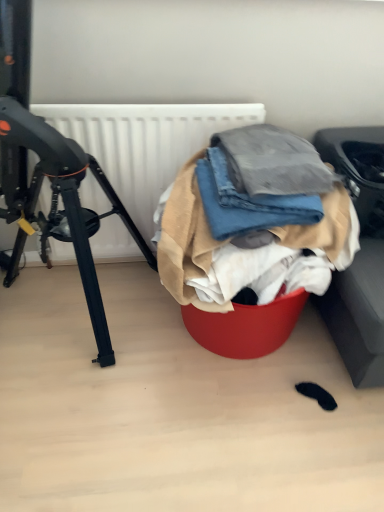
The image size is (384, 512). Describe the element at coordinates (65, 203) in the screenshot. I see `black matte tripod at left` at that location.

Describe the element at coordinates (273, 162) in the screenshot. The width and height of the screenshot is (384, 512). I see `denim fabric at center, marked as the first clothing in a top-to-bottom arrangement` at that location.

Locate an element on the screen. The width and height of the screenshot is (384, 512). white matte radiator at upper center is located at coordinates (145, 143).

The image size is (384, 512). I want to click on denim fabric at center, which ranks as the first clothing in bottom-to-top order, so click(252, 223).

This screenshot has height=512, width=384. Identify the location of black matte tripod at left. (65, 203).

Who is smaller, denim fabric at center, the 3th clothing when ordered from bottom to top, or denim fabric at center, marked as the third clothing in a top-to-bottom arrangement?

With smaller size is denim fabric at center, the 3th clothing when ordered from bottom to top.

Does denim fabric at center, the 3th clothing when ordered from bottom to top, contain denim fabric at center, which ranks as the first clothing in bottom-to-top order?

Answer: Actually, denim fabric at center, which ranks as the first clothing in bottom-to-top order, is outside denim fabric at center, the 3th clothing when ordered from bottom to top.

Looking at this image, is denim fabric at center, marked as the first clothing in a top-to-bottom arrangement, far from denim fabric at center, marked as the third clothing in a top-to-bottom arrangement?

No, denim fabric at center, marked as the first clothing in a top-to-bottom arrangement, is in close proximity to denim fabric at center, marked as the third clothing in a top-to-bottom arrangement.

From the image's perspective, count 2nd clothings upward from the denim fabric at center, which ranks as the first clothing in bottom-to-top order, and point to it. Please provide its 2D coordinates.

[(273, 162)]

Is denim fabric at center, the 3th clothing when ordered from bottom to top, taller or shorter than denim fabric at center, acting as the second clothing starting from the bottom?

Considering their sizes, denim fabric at center, the 3th clothing when ordered from bottom to top, has less height than denim fabric at center, acting as the second clothing starting from the bottom.

Is point (257, 146) less distant than point (298, 197)?

That is False.

From the image's perspective, who appears lower, denim fabric at center, marked as the first clothing in a top-to-bottom arrangement, or denim fabric at center, which is the second clothing in top-to-bottom order?

From the image's view, denim fabric at center, which is the second clothing in top-to-bottom order, is below.

Is denim fabric at center, the 3th clothing when ordered from bottom to top, not inside denim fabric at center, acting as the second clothing starting from the bottom?

No, most part of denim fabric at center, the 3th clothing when ordered from bottom to top, lies within denim fabric at center, acting as the second clothing starting from the bottom.

Are denim fabric at center, which is the second clothing in top-to-bottom order, and denim fabric at center, which ranks as the first clothing in bottom-to-top order, beside each other?

Yes, denim fabric at center, which is the second clothing in top-to-bottom order, is in contact with denim fabric at center, which ranks as the first clothing in bottom-to-top order.

Does denim fabric at center, acting as the second clothing starting from the bottom, turn towards denim fabric at center, which ranks as the first clothing in bottom-to-top order?

Yes, denim fabric at center, acting as the second clothing starting from the bottom, is facing denim fabric at center, which ranks as the first clothing in bottom-to-top order.

Which object is further away from the camera, denim fabric at center, which is the second clothing in top-to-bottom order, or denim fabric at center, marked as the third clothing in a top-to-bottom arrangement?

denim fabric at center, which is the second clothing in top-to-bottom order, is behind.

Is denim fabric at center, which is the second clothing in top-to-bottom order, bigger than denim fabric at center, which ranks as the first clothing in bottom-to-top order?

No, denim fabric at center, which is the second clothing in top-to-bottom order, is not bigger than denim fabric at center, which ranks as the first clothing in bottom-to-top order.

Who is smaller, black matte tripod at left or denim fabric at center, acting as the second clothing starting from the bottom?

Smaller between the two is denim fabric at center, acting as the second clothing starting from the bottom.

Can you confirm if black matte tripod at left is thinner than denim fabric at center, acting as the second clothing starting from the bottom?

No, black matte tripod at left is not thinner than denim fabric at center, acting as the second clothing starting from the bottom.

Is point (39, 128) farther from camera compared to point (212, 189)?

No, (39, 128) is in front of (212, 189).

Does black matte tripod at left contain denim fabric at center, which is the second clothing in top-to-bottom order?

That's incorrect, denim fabric at center, which is the second clothing in top-to-bottom order, is not inside black matte tripod at left.

Is the depth of white matte radiator at upper center greater than that of denim fabric at center, which ranks as the first clothing in bottom-to-top order?

Yes.

Is white matte radiator at upper center to the left or to the right of denim fabric at center, which ranks as the first clothing in bottom-to-top order, in the image?

white matte radiator at upper center is positioned on denim fabric at center, which ranks as the first clothing in bottom-to-top order,'s left side.

From a real-world perspective, which object stands above the other?

denim fabric at center, which ranks as the first clothing in bottom-to-top order, from a real-world perspective.

Can denim fabric at center, which ranks as the first clothing in bottom-to-top order, be found inside white matte radiator at upper center?

Actually, denim fabric at center, which ranks as the first clothing in bottom-to-top order, is outside white matte radiator at upper center.

From a real-world perspective, who is located lower, white matte radiator at upper center or black matte tripod at left?

white matte radiator at upper center.

Are white matte radiator at upper center and black matte tripod at left beside each other?

white matte radiator at upper center is not next to black matte tripod at left, and they're not touching.

Considering the relative positions of white matte radiator at upper center and black matte tripod at left in the image provided, is white matte radiator at upper center to the left of black matte tripod at left from the viewer's perspective?

No.

Where is `radiator below the black matte tripod at left (from a real-world perspective)`? This screenshot has height=512, width=384. radiator below the black matte tripod at left (from a real-world perspective) is located at coordinates (145, 143).

From a real-world perspective, who is located lower, denim fabric at center, acting as the second clothing starting from the bottom, or denim fabric at center, the 3th clothing when ordered from bottom to top?

denim fabric at center, acting as the second clothing starting from the bottom, from a real-world perspective.

Are denim fabric at center, which is the second clothing in top-to-bottom order, and denim fabric at center, the 3th clothing when ordered from bottom to top, far apart?

No, denim fabric at center, which is the second clothing in top-to-bottom order, is in close proximity to denim fabric at center, the 3th clothing when ordered from bottom to top.

Image resolution: width=384 pixels, height=512 pixels. In order to click on the 1st clothing directly beneath the denim fabric at center, marked as the first clothing in a top-to-bottom arrangement (from a real-world perspective) in this screenshot , I will do `click(247, 202)`.

Is denim fabric at center, which is the second clothing in top-to-bottom order, turned away from denim fabric at center, marked as the first clothing in a top-to-bottom arrangement?

Yes, denim fabric at center, which is the second clothing in top-to-bottom order, is positioned with its back facing denim fabric at center, marked as the first clothing in a top-to-bottom arrangement.

Find the location of a particular element. Image resolution: width=384 pixels, height=512 pixels. the 2nd clothing positioned above the denim fabric at center, marked as the third clothing in a top-to-bottom arrangement (from a real-world perspective) is located at coordinates (273, 162).

Find the location of a particular element. The height and width of the screenshot is (512, 384). clothing above the denim fabric at center, which is the second clothing in top-to-bottom order (from the image's perspective) is located at coordinates (273, 162).

Consider the image. Based on their spatial positions, is denim fabric at center, marked as the third clothing in a top-to-bottom arrangement, or white matte radiator at upper center closer to denim fabric at center, marked as the first clothing in a top-to-bottom arrangement?

denim fabric at center, marked as the third clothing in a top-to-bottom arrangement, is closer to denim fabric at center, marked as the first clothing in a top-to-bottom arrangement.

Consider the image. Estimate the real-world distances between objects in this image. Which object is further from denim fabric at center, the 3th clothing when ordered from bottom to top, black matte tripod at left or denim fabric at center, acting as the second clothing starting from the bottom?

black matte tripod at left lies further to denim fabric at center, the 3th clothing when ordered from bottom to top, than the other object.

Which object lies nearer to the anchor point black matte tripod at left, white matte radiator at upper center or denim fabric at center, marked as the third clothing in a top-to-bottom arrangement?

Among the two, white matte radiator at upper center is located nearer to black matte tripod at left.

Estimate the real-world distances between objects in this image. Which object is closer to black matte tripod at left, denim fabric at center, which ranks as the first clothing in bottom-to-top order, or denim fabric at center, the 3th clothing when ordered from bottom to top?

denim fabric at center, which ranks as the first clothing in bottom-to-top order, lies closer to black matte tripod at left than the other object.

Based on the photo, estimate the real-world distances between objects in this image. Which object is further from denim fabric at center, acting as the second clothing starting from the bottom, black matte tripod at left or denim fabric at center, which ranks as the first clothing in bottom-to-top order?

black matte tripod at left.

From the image, which object appears to be nearer to white matte radiator at upper center, denim fabric at center, which ranks as the first clothing in bottom-to-top order, or denim fabric at center, which is the second clothing in top-to-bottom order?

Among the two, denim fabric at center, which ranks as the first clothing in bottom-to-top order, is located nearer to white matte radiator at upper center.

Looking at this image, which object lies further to the anchor point denim fabric at center, the 3th clothing when ordered from bottom to top, white matte radiator at upper center or denim fabric at center, which ranks as the first clothing in bottom-to-top order?

white matte radiator at upper center is positioned further to the anchor denim fabric at center, the 3th clothing when ordered from bottom to top.

Estimate the real-world distances between objects in this image. Which object is closer to black matte tripod at left, denim fabric at center, marked as the first clothing in a top-to-bottom arrangement, or denim fabric at center, which ranks as the first clothing in bottom-to-top order?

denim fabric at center, which ranks as the first clothing in bottom-to-top order, is positioned closer to the anchor black matte tripod at left.

The image size is (384, 512). Identify the location of clothing between denim fabric at center, marked as the first clothing in a top-to-bottom arrangement, and denim fabric at center, which ranks as the first clothing in bottom-to-top order, vertically. (247, 202).

At what (x,y) coordinates should I click in order to perform the action: click on radiator situated between black matte tripod at left and denim fabric at center, marked as the first clothing in a top-to-bottom arrangement, from left to right. Please return your answer as a coordinate pair (x, y). Looking at the image, I should click on (145, 143).

Identify the location of clothing between black matte tripod at left and denim fabric at center, which is the second clothing in top-to-bottom order. The height and width of the screenshot is (512, 384). pyautogui.click(x=252, y=223).

I want to click on clothing between white matte radiator at upper center and denim fabric at center, which is the second clothing in top-to-bottom order, so click(252, 223).